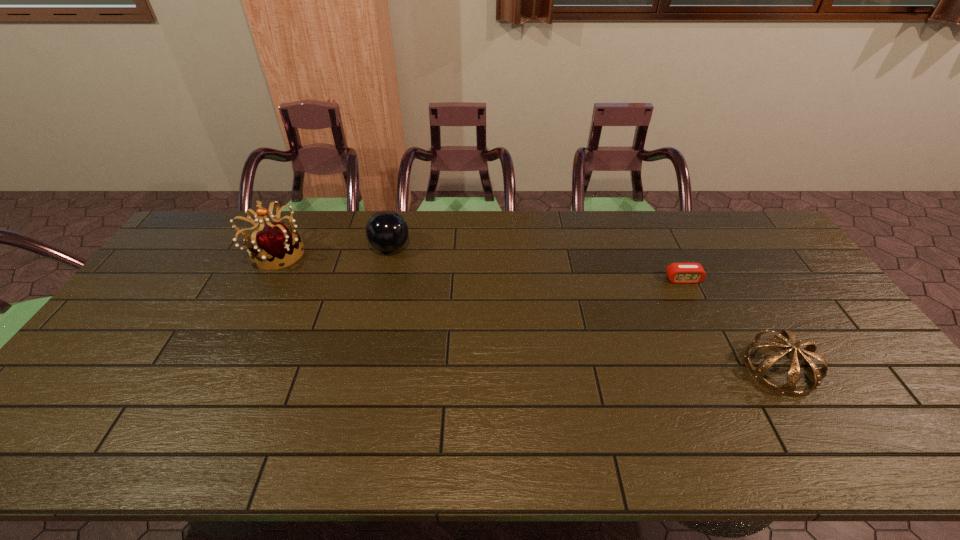
Image resolution: width=960 pixels, height=540 pixels. I want to click on vacant area that lies between the third tallest object and the second tallest object, so click(x=585, y=308).

Locate an element on the screen. Image resolution: width=960 pixels, height=540 pixels. vacant area that lies between the farther tiara and the shortest object is located at coordinates (479, 267).

This screenshot has height=540, width=960. Identify the location of free space between the leftmost object and the nearest object. (527, 311).

At what (x,y) coordinates should I click in order to perform the action: click on free space between the second object from left to right and the nearer tiara. Please return your answer as a coordinate pair (x, y). Image resolution: width=960 pixels, height=540 pixels. Looking at the image, I should click on (585, 308).

This screenshot has height=540, width=960. Find the location of `vacant area that lies between the bowling ball and the right tiara`. vacant area that lies between the bowling ball and the right tiara is located at coordinates (585, 308).

Image resolution: width=960 pixels, height=540 pixels. Find the location of `vacant area that lies between the bowling ball and the shortest object`. vacant area that lies between the bowling ball and the shortest object is located at coordinates (537, 264).

You are a GUI agent. You are given a task and a screenshot of the screen. Output one action in this format:
    pyautogui.click(x=<x>, y=<y>)
    Task: Click on the free space between the third shortest object and the shortest object
    The image size is (960, 540).
    Given the screenshot: What is the action you would take?
    pyautogui.click(x=537, y=264)

Where is `free area in between the tallest object and the shortest object`? This screenshot has height=540, width=960. free area in between the tallest object and the shortest object is located at coordinates (479, 267).

Identify the location of object that is the second closest to the left tiara. (682, 273).

Select which object is the closest to the shortest object. Please provide its 2D coordinates. Your answer should be formatted as a tuple, i.e. [(x, y)], where the tuple contains the x and y coordinates of a point satisfying the conditions above.

[(788, 388)]